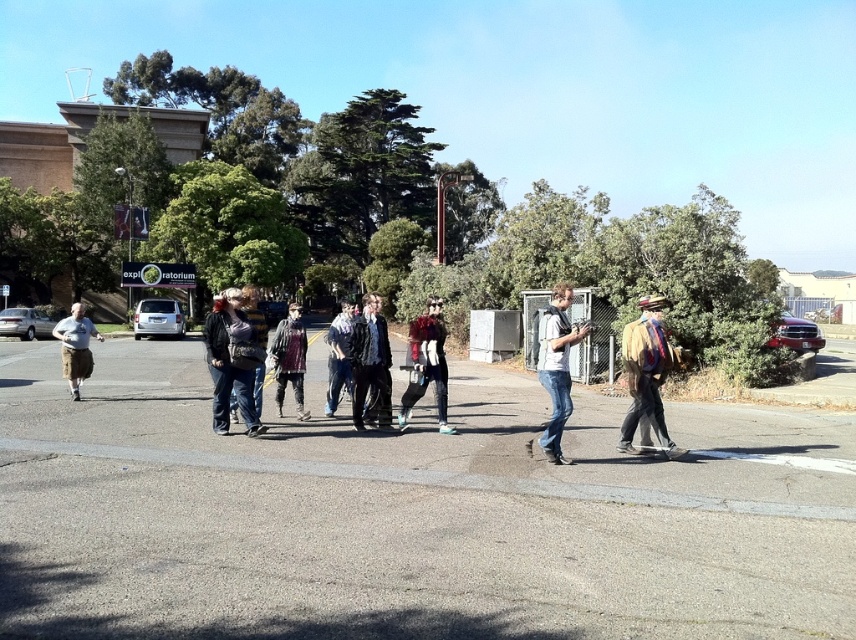
Between brown leather jacket at center and distressed denim jacket at center, which one appears on the left side from the viewer's perspective?

Positioned to the left is distressed denim jacket at center.

Who is more forward, (635, 326) or (280, 356)?

Positioned in front is point (635, 326).

Describe the element at coordinates (646, 374) in the screenshot. I see `brown leather jacket at center` at that location.

Where is `brown leather jacket at center`? The height and width of the screenshot is (640, 856). brown leather jacket at center is located at coordinates (646, 374).

Can you confirm if denim jeans at center is positioned to the left of distressed denim jacket at center?

In fact, denim jeans at center is to the right of distressed denim jacket at center.

Does denim jeans at center have a lesser width compared to distressed denim jacket at center?

Indeed, denim jeans at center has a lesser width compared to distressed denim jacket at center.

Where is `denim jeans at center`? This screenshot has width=856, height=640. denim jeans at center is located at coordinates (556, 365).

Is brown leather jacket at center further to the viewer compared to denim jeans at center?

Yes.

Is brown leather jacket at center taller than denim jeans at center?

Indeed, brown leather jacket at center has a greater height compared to denim jeans at center.

The height and width of the screenshot is (640, 856). Identify the location of brown leather jacket at center. (646, 374).